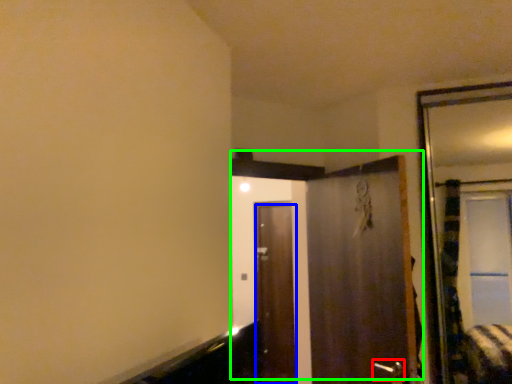
Question: Which object is the closest to the door handle (highlighted by a red box)? Choose among these: door (highlighted by a blue box) or door (highlighted by a green box).

Choices:
 (A) door
 (B) door

Answer: (B)